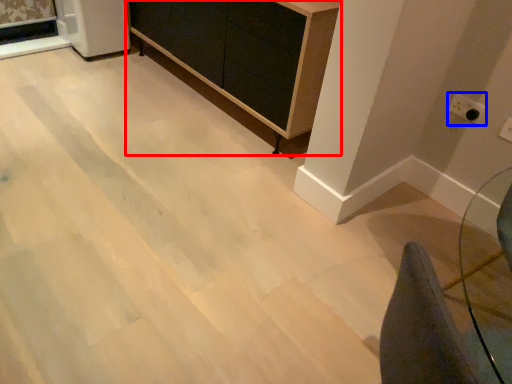
Question: Among these objects, which one is nearest to the camera, furniture (highlighted by a red box) or electric outlet (highlighted by a blue box)?

Choices:
 (A) furniture
 (B) electric outlet

Answer: (A)